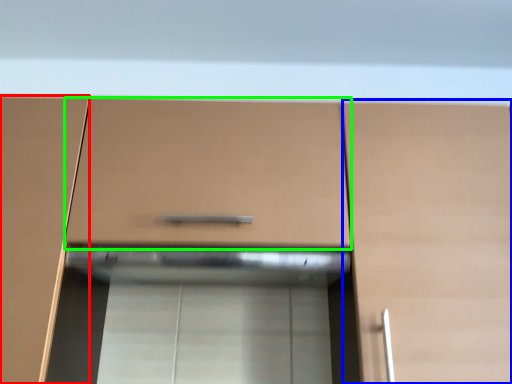
Question: Which is farther away from cabinetry (highlighted by a red box)? cabinetry (highlighted by a blue box) or drawer (highlighted by a green box)?

Choices:
 (A) cabinetry
 (B) drawer

Answer: (A)